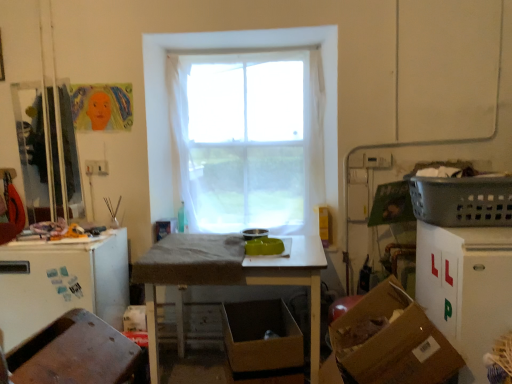
What do you see at coordinates (75, 353) in the screenshot? I see `wooden chair at lower left` at bounding box center [75, 353].

Where is `translucent fabric window at center`? The width and height of the screenshot is (512, 384). translucent fabric window at center is located at coordinates (223, 52).

Is wooden chair at lower left thinner than brown cardboard box at lower center, the second cardboard box in the right-to-left sequence?

Correct, the width of wooden chair at lower left is less than that of brown cardboard box at lower center, the second cardboard box in the right-to-left sequence.

Between point (63, 376) and point (278, 302), which one is positioned behind?

Point (278, 302)

Considering the positions of objects wooden chair at lower left and brown cardboard box at lower center, the second cardboard box in the right-to-left sequence, in the image provided, who is behind, wooden chair at lower left or brown cardboard box at lower center, the second cardboard box in the right-to-left sequence,?

Positioned behind is brown cardboard box at lower center, the second cardboard box in the right-to-left sequence.

Is translucent fabric window at center far away from brown cardboard box at lower right, acting as the 1th cardboard box starting from the front?

That's right, there is a large distance between translucent fabric window at center and brown cardboard box at lower right, acting as the 1th cardboard box starting from the front.

Does point (206, 47) come farther from viewer compared to point (379, 362)?

That is True.

Is translucent fabric window at center turned away from brown cardboard box at lower right, which is the second cardboard box in back-to-front order?

No, translucent fabric window at center is not facing the opposite direction of brown cardboard box at lower right, which is the second cardboard box in back-to-front order.

From a real-world perspective, does translucent fabric window at center stand above brown cardboard box at lower right, the 2th cardboard box viewed from the left?

Yes, from a real-world perspective, translucent fabric window at center is on top of brown cardboard box at lower right, the 2th cardboard box viewed from the left.

Which of these two, translucent fabric window at center or white matte refrigerator at left, is thinner?

translucent fabric window at center is thinner.

Between translucent fabric window at center and white matte refrigerator at left, which one appears on the right side from the viewer's perspective?

Positioned to the right is translucent fabric window at center.

From a real-world perspective, relative to white matte refrigerator at left, is translucent fabric window at center vertically above or below?

From a real-world perspective, translucent fabric window at center is physically above white matte refrigerator at left.

Is wooden table at center smaller than translucent fabric window at center?

Actually, wooden table at center might be larger than translucent fabric window at center.

From a real-world perspective, which object stands above the other?

translucent fabric window at center.

Locate an element on the screen. The image size is (512, 384). window on the right of wooden table at center is located at coordinates (223, 52).

Which is more to the right, wooden table at center or translucent fabric window at center?

From the viewer's perspective, translucent fabric window at center appears more on the right side.

Considering the sizes of objects translucent fabric window at center and gray plastic laundry basket at right in the image provided, who is bigger, translucent fabric window at center or gray plastic laundry basket at right?

translucent fabric window at center is bigger.

From their relative heights in the image, would you say translucent fabric window at center is taller or shorter than gray plastic laundry basket at right?

Considering their sizes, translucent fabric window at center has more height than gray plastic laundry basket at right.

Between translucent fabric window at center and gray plastic laundry basket at right, which one is positioned in front?

Positioned in front is gray plastic laundry basket at right.

There is a brown cardboard box at lower center, arranged as the 2th cardboard box when viewed from the front. Where is `basket above it (from a real-world perspective)`? basket above it (from a real-world perspective) is located at coordinates [462, 201].

Measure the distance from brown cardboard box at lower center, marked as the first cardboard box in a back-to-front arrangement, to gray plastic laundry basket at right.

They are 3.75 feet apart.

Considering the positions of point (286, 362) and point (488, 188), is point (286, 362) closer or farther from the camera than point (488, 188)?

Point (286, 362) is farther from the camera than point (488, 188).

How different are the orientations of wooden chair at lower left and translucent fabric window at center in degrees?

They differ by 91.8 degrees in their facing directions.

Can you confirm if wooden chair at lower left is smaller than translucent fabric window at center?

Yes, wooden chair at lower left is smaller than translucent fabric window at center.

This screenshot has height=384, width=512. I want to click on window above the wooden chair at lower left (from the image's perspective), so click(x=223, y=52).

Which is in front, point (91, 356) or point (323, 62)?

The point (91, 356) is closer to the camera.

Locate an element on the screen. This screenshot has height=384, width=512. chair above the brown cardboard box at lower center, marked as the first cardboard box in a back-to-front arrangement (from the image's perspective) is located at coordinates (75, 353).

Locate an element on the screen. cardboard box that is the 1st object located below the translucent fabric window at center (from the image's perspective) is located at coordinates (388, 342).

Estimate the real-world distances between objects in this image. Which object is further from brown cardboard box at lower center, the 1th cardboard box when ordered from left to right, white matte refrigerator at left or wooden chair at lower left?

wooden chair at lower left is positioned further to the anchor brown cardboard box at lower center, the 1th cardboard box when ordered from left to right.

Based on the photo, based on their spatial positions, is translucent fabric window at center or white matte refrigerator at left further from gray plastic laundry basket at right?

white matte refrigerator at left is positioned further to the anchor gray plastic laundry basket at right.

From the image, which object appears to be farther from brown cardboard box at lower right, positioned as the 1th cardboard box in right-to-left order, gray plastic laundry basket at right or wooden table at center?

gray plastic laundry basket at right is positioned further to the anchor brown cardboard box at lower right, positioned as the 1th cardboard box in right-to-left order.

Looking at the image, which one is located closer to gray plastic laundry basket at right, wooden table at center or translucent fabric window at center?

wooden table at center lies closer to gray plastic laundry basket at right than the other object.

Consider the image. Estimate the real-world distances between objects in this image. Which object is further from wooden table at center, wooden chair at lower left or brown cardboard box at lower right, positioned as the 1th cardboard box in right-to-left order?

wooden chair at lower left is further to wooden table at center.

Based on their spatial positions, is white matte refrigerator at left or brown cardboard box at lower center, the 1th cardboard box when ordered from left to right, closer to brown cardboard box at lower right, positioned as the 1th cardboard box in right-to-left order?

brown cardboard box at lower center, the 1th cardboard box when ordered from left to right, lies closer to brown cardboard box at lower right, positioned as the 1th cardboard box in right-to-left order, than the other object.

Considering their positions, is wooden chair at lower left positioned closer to gray plastic laundry basket at right than translucent fabric window at center?

translucent fabric window at center.

Estimate the real-world distances between objects in this image. Which object is closer to gray plastic laundry basket at right, white matte refrigerator at left or translucent fabric window at center?

Based on the image, translucent fabric window at center appears to be nearer to gray plastic laundry basket at right.

Where is `table between white matte refrigerator at left and gray plastic laundry basket at right from left to right`? table between white matte refrigerator at left and gray plastic laundry basket at right from left to right is located at coordinates (228, 276).

Locate an element on the screen. Image resolution: width=512 pixels, height=384 pixels. cardboard box between translucent fabric window at center and brown cardboard box at lower center, the second cardboard box in the right-to-left sequence, from top to bottom is located at coordinates (388, 342).

This screenshot has width=512, height=384. What are the coordinates of `table between white matte refrigerator at left and translucent fabric window at center in the horizontal direction` in the screenshot? It's located at (228, 276).

In order to click on cardboard box between brown cardboard box at lower center, the second cardboard box in the right-to-left sequence, and gray plastic laundry basket at right from left to right in this screenshot , I will do `click(388, 342)`.